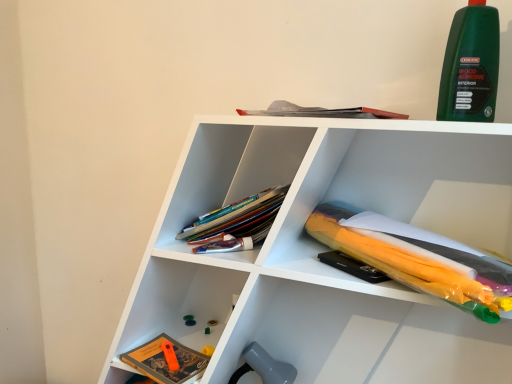
Question: Is translucent plastic umbrella at lower right, which is counted as the first book, starting from the right, to the right of green matte wood adhesive at upper right from the viewer's perspective?

Choices:
 (A) yes
 (B) no

Answer: (B)

Question: From the image's perspective, is translucent plastic umbrella at lower right, the second book from the bottom, on green matte wood adhesive at upper right?

Choices:
 (A) no
 (B) yes

Answer: (A)

Question: Is the depth of translucent plastic umbrella at lower right, the 2th book in the left-to-right sequence, less than that of green matte wood adhesive at upper right?

Choices:
 (A) yes
 (B) no

Answer: (A)

Question: Does translucent plastic umbrella at lower right, the second book from the bottom, have a larger size compared to green matte wood adhesive at upper right?

Choices:
 (A) yes
 (B) no

Answer: (A)

Question: From a real-world perspective, is translucent plastic umbrella at lower right, the second book from the bottom, positioned under green matte wood adhesive at upper right based on gravity?

Choices:
 (A) no
 (B) yes

Answer: (B)

Question: From the image's perspective, does translucent plastic umbrella at lower right, the 2th book in the left-to-right sequence, appear lower than green matte wood adhesive at upper right?

Choices:
 (A) yes
 (B) no

Answer: (A)

Question: Does green matte wood adhesive at upper right have a greater width compared to translucent plastic umbrella at lower right, the 2th book in the left-to-right sequence?

Choices:
 (A) yes
 (B) no

Answer: (B)

Question: Can you confirm if green matte wood adhesive at upper right is smaller than translucent plastic umbrella at lower right, which is counted as the first book, starting from the right?

Choices:
 (A) yes
 (B) no

Answer: (A)

Question: Is green matte wood adhesive at upper right at the right side of translucent plastic umbrella at lower right, which is counted as the first book, starting from the right?

Choices:
 (A) yes
 (B) no

Answer: (A)

Question: Is green matte wood adhesive at upper right not inside translucent plastic umbrella at lower right, which is counted as the first book, starting from the right?

Choices:
 (A) no
 (B) yes

Answer: (B)

Question: From a real-world perspective, is green matte wood adhesive at upper right located beneath translucent plastic umbrella at lower right, which is counted as the first book, starting from the right?

Choices:
 (A) no
 (B) yes

Answer: (A)

Question: Is green matte wood adhesive at upper right to the left of translucent plastic umbrella at lower right, the second book from the bottom, from the viewer's perspective?

Choices:
 (A) yes
 (B) no

Answer: (B)

Question: Is hardcover book at lower left, which is counted as the 1th book, starting from the bottom, closer to the viewer compared to green plastic toy at lower center?

Choices:
 (A) yes
 (B) no

Answer: (A)